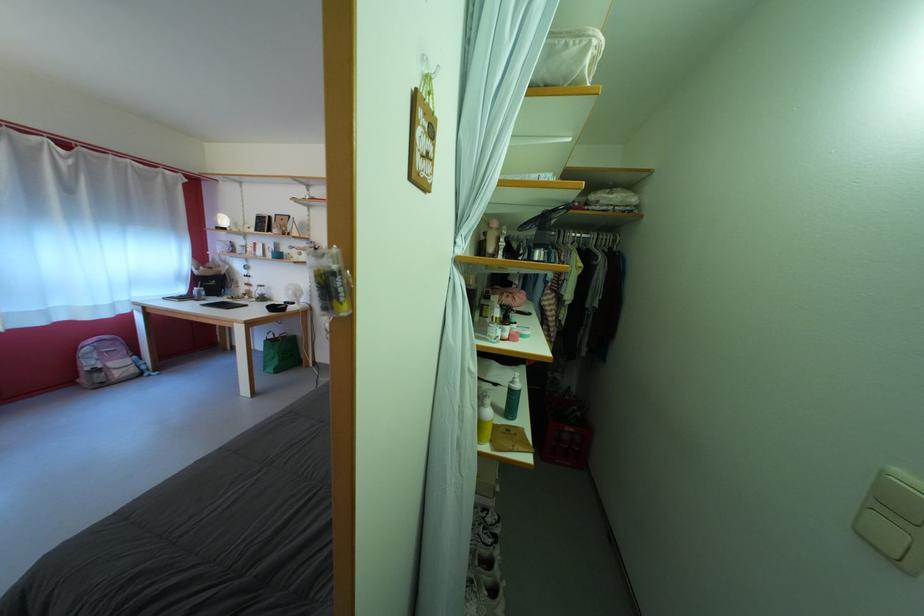
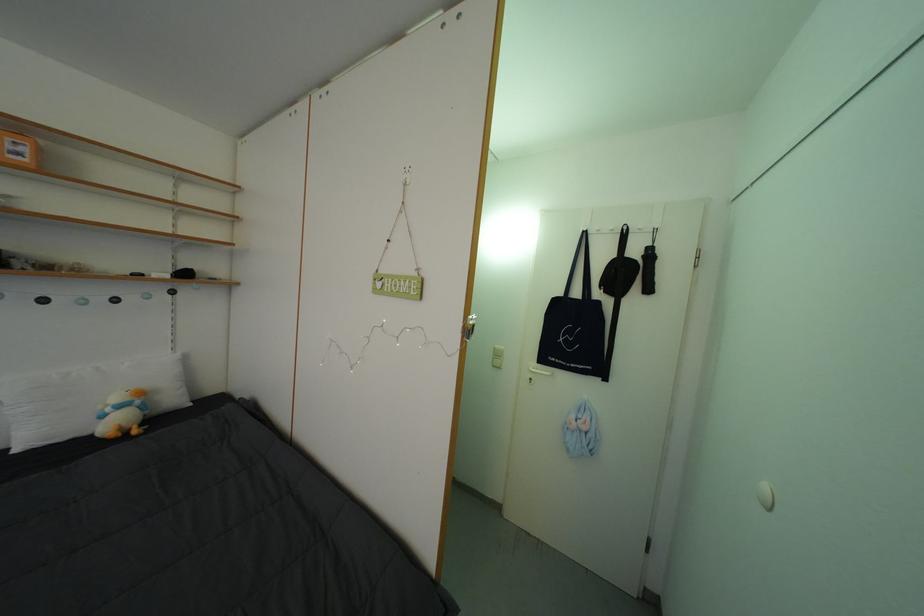
In the second image, find the point that corresponds to point (893, 479) in the first image.

(504, 354)